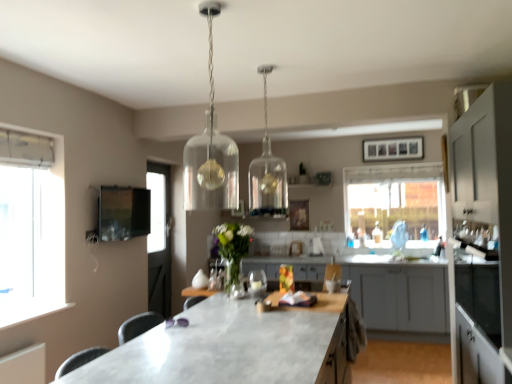
Question: Can you confirm if white marble countertop at center is wider than translucent glass vase at center?

Choices:
 (A) yes
 (B) no

Answer: (A)

Question: Would you say white marble countertop at center is outside translucent glass vase at center?

Choices:
 (A) yes
 (B) no

Answer: (A)

Question: From a real-world perspective, is white marble countertop at center physically above translucent glass vase at center?

Choices:
 (A) yes
 (B) no

Answer: (B)

Question: Can you confirm if white marble countertop at center is positioned to the left of translucent glass vase at center?

Choices:
 (A) yes
 (B) no

Answer: (B)

Question: From the image's perspective, is white marble countertop at center above translucent glass vase at center?

Choices:
 (A) yes
 (B) no

Answer: (B)

Question: Is white marble countertop at center far away from translucent glass vase at center?

Choices:
 (A) yes
 (B) no

Answer: (B)

Question: Considering the relative sizes of clear glass wine glass at center and white marble countertop at center in the image provided, is clear glass wine glass at center taller than white marble countertop at center?

Choices:
 (A) no
 (B) yes

Answer: (A)

Question: Does clear glass wine glass at center turn towards white marble countertop at center?

Choices:
 (A) yes
 (B) no

Answer: (B)

Question: Is clear glass wine glass at center facing away from white marble countertop at center?

Choices:
 (A) no
 (B) yes

Answer: (A)

Question: From the image's perspective, does clear glass wine glass at center appear lower than white marble countertop at center?

Choices:
 (A) no
 (B) yes

Answer: (A)

Question: Does clear glass wine glass at center have a smaller size compared to white marble countertop at center?

Choices:
 (A) yes
 (B) no

Answer: (A)

Question: Can you confirm if clear glass wine glass at center is positioned to the left of white marble countertop at center?

Choices:
 (A) yes
 (B) no

Answer: (B)

Question: Would you say matte black tv at upper left contains white matte cabinet at right, placed as the 2th cabinetry when sorted from back to front?

Choices:
 (A) no
 (B) yes

Answer: (A)